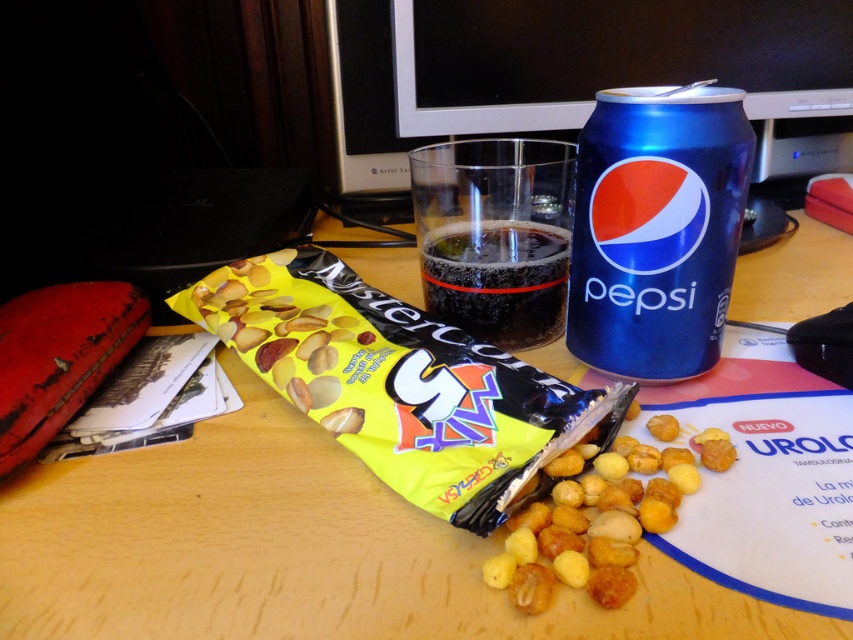
Between blue metallic can at upper right and dark carbonated liquid at center, which one is positioned lower?

dark carbonated liquid at center

Image resolution: width=853 pixels, height=640 pixels. I want to click on blue metallic can at upper right, so [656, 228].

Image resolution: width=853 pixels, height=640 pixels. What do you see at coordinates (656, 228) in the screenshot?
I see `blue metallic can at upper right` at bounding box center [656, 228].

Locate an element on the screen. The height and width of the screenshot is (640, 853). blue metallic can at upper right is located at coordinates (656, 228).

Does point (776, 627) lie behind point (444, 225)?

That is False.

The height and width of the screenshot is (640, 853). In order to click on wooden table at center in this screenshot , I will do `click(294, 550)`.

The width and height of the screenshot is (853, 640). Find the location of `wooden table at center`. wooden table at center is located at coordinates (294, 550).

Is yellow matte snack at center below dark carbonated liquid at center?

Correct, yellow matte snack at center is located below dark carbonated liquid at center.

Can you confirm if yellow matte snack at center is thinner than dark carbonated liquid at center?

No.

Which is behind, point (578, 499) or point (506, 291)?

The point (506, 291) is more distant.

At what (x,y) coordinates should I click in order to perform the action: click on yellow matte snack at center. Please return your answer as a coordinate pair (x, y). The width and height of the screenshot is (853, 640). Looking at the image, I should click on (593, 528).